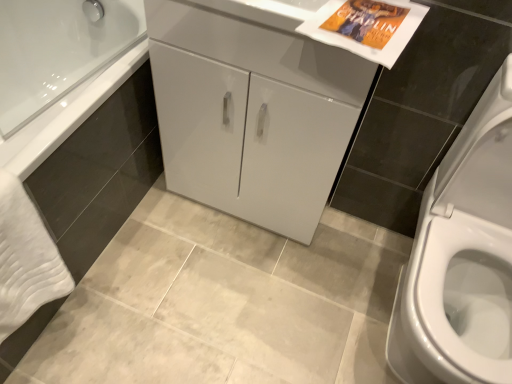
Question: Does white glossy cabinet at center have a greater width compared to white glossy cabinet at center?

Choices:
 (A) no
 (B) yes

Answer: (A)

Question: Is white glossy cabinet at center thinner than white glossy cabinet at center?

Choices:
 (A) no
 (B) yes

Answer: (B)

Question: Are white glossy cabinet at center and white glossy cabinet at center located far from each other?

Choices:
 (A) no
 (B) yes

Answer: (A)

Question: Is white glossy cabinet at center oriented away from white glossy cabinet at center?

Choices:
 (A) no
 (B) yes

Answer: (A)

Question: From the image's perspective, is white glossy cabinet at center under white glossy cabinet at center?

Choices:
 (A) yes
 (B) no

Answer: (A)

Question: Is white glossy cabinet at center not inside white glossy cabinet at center?

Choices:
 (A) no
 (B) yes

Answer: (B)

Question: Is white glossy cabinet at center surrounding white soft towel at lower left?

Choices:
 (A) no
 (B) yes

Answer: (A)

Question: Considering the relative sizes of white glossy cabinet at center and white soft towel at lower left in the image provided, is white glossy cabinet at center smaller than white soft towel at lower left?

Choices:
 (A) no
 (B) yes

Answer: (A)

Question: Is white glossy cabinet at center not inside white soft towel at lower left?

Choices:
 (A) yes
 (B) no

Answer: (A)

Question: Considering the relative sizes of white glossy cabinet at center and white soft towel at lower left in the image provided, is white glossy cabinet at center thinner than white soft towel at lower left?

Choices:
 (A) yes
 (B) no

Answer: (B)

Question: From a real-world perspective, does white glossy cabinet at center stand above white soft towel at lower left?

Choices:
 (A) no
 (B) yes

Answer: (B)

Question: Is white glossy cabinet at center looking in the opposite direction of white soft towel at lower left?

Choices:
 (A) no
 (B) yes

Answer: (A)

Question: Can you confirm if white glossy cabinet at center is smaller than white soft towel at lower left?

Choices:
 (A) yes
 (B) no

Answer: (B)